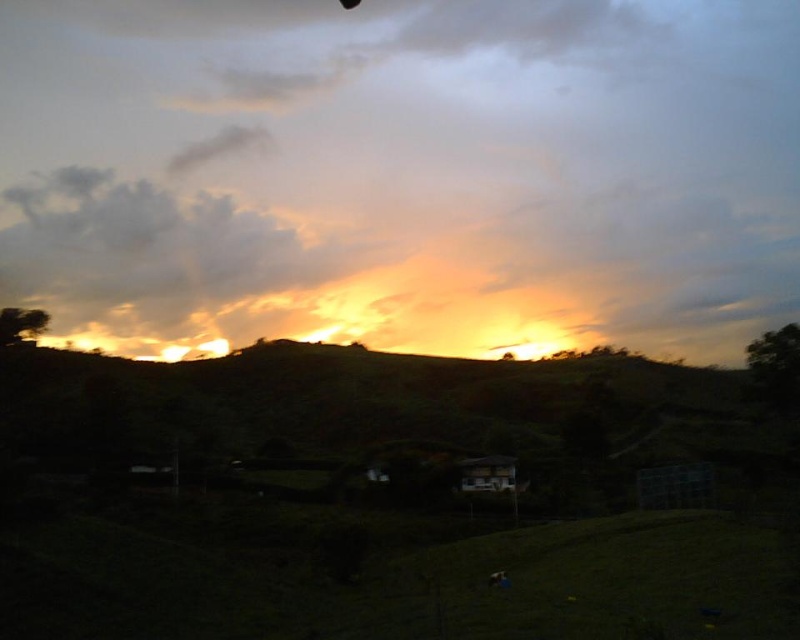
Looking at this image, which of these two, cloudy orange sky at upper center or cloudy sky at upper center, stands taller?

Standing taller between the two is cloudy orange sky at upper center.

Is the position of cloudy orange sky at upper center more distant than that of cloudy sky at upper center?

No, it is in front of cloudy sky at upper center.

Where is `cloudy orange sky at upper center`? This screenshot has width=800, height=640. cloudy orange sky at upper center is located at coordinates 162,260.

This screenshot has height=640, width=800. What are the coordinates of `cloudy orange sky at upper center` in the screenshot? It's located at (162, 260).